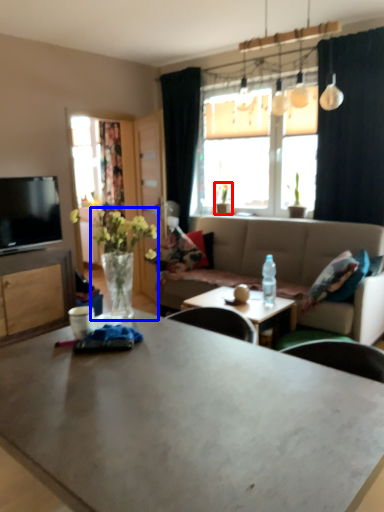
Question: Among these objects, which one is farthest to the camera, houseplant (highlighted by a red box) or floral arrangement (highlighted by a blue box)?

Choices:
 (A) houseplant
 (B) floral arrangement

Answer: (A)